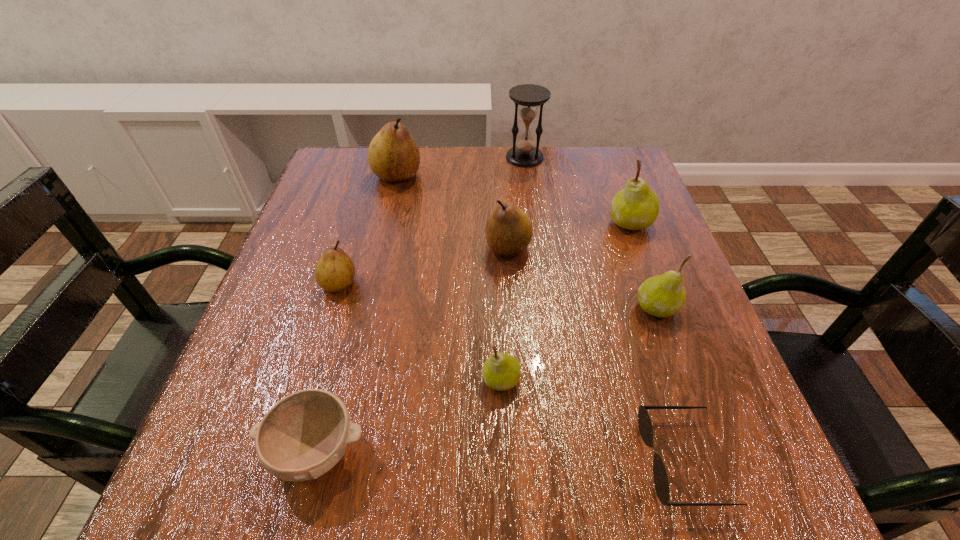
The width and height of the screenshot is (960, 540). I want to click on sunglasses that is at the right edge, so click(661, 483).

In order to click on object located in the far left corner section of the desktop in this screenshot , I will do `click(393, 155)`.

Where is `object that is at the near left corner`? object that is at the near left corner is located at coordinates (304, 435).

I want to click on object present at the near right corner, so click(x=661, y=483).

Locate an element on the screen. The image size is (960, 540). vacant space at the far edge of the desktop is located at coordinates (427, 154).

The image size is (960, 540). I want to click on free region at the near edge of the desktop, so click(x=438, y=509).

Where is `vacant region at the left edge`? vacant region at the left edge is located at coordinates (330, 208).

The image size is (960, 540). I want to click on free space at the right edge, so click(680, 418).

The image size is (960, 540). In order to click on vacant space at the near right corner of the desktop in this screenshot , I will do `click(757, 512)`.

Where is `free space between the rightmost brown pear and the farthest green pear`? The image size is (960, 540). free space between the rightmost brown pear and the farthest green pear is located at coordinates (569, 235).